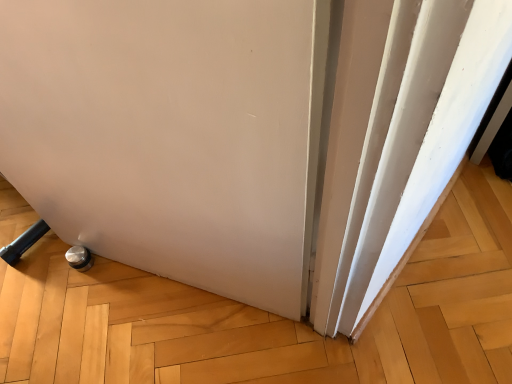
Question: Should I look upward or downward to see white matte door at lower left?

Choices:
 (A) up
 (B) down

Answer: (B)

Question: From a real-world perspective, is white matte curtain at right on white matte door at lower left?

Choices:
 (A) yes
 (B) no

Answer: (B)

Question: Is white matte curtain at right surrounding white matte door at lower left?

Choices:
 (A) yes
 (B) no

Answer: (B)

Question: Is white matte curtain at right in contact with white matte door at lower left?

Choices:
 (A) yes
 (B) no

Answer: (B)

Question: Is white matte curtain at right in front of white matte door at lower left?

Choices:
 (A) no
 (B) yes

Answer: (A)

Question: Is white matte curtain at right completely or partially outside of white matte door at lower left?

Choices:
 (A) yes
 (B) no

Answer: (A)

Question: Is white matte curtain at right positioned with its back to white matte door at lower left?

Choices:
 (A) no
 (B) yes

Answer: (A)

Question: Considering the relative sizes of white matte door at lower left and white matte curtain at right in the image provided, is white matte door at lower left smaller than white matte curtain at right?

Choices:
 (A) yes
 (B) no

Answer: (B)

Question: Is white matte door at lower left closer to the viewer compared to white matte curtain at right?

Choices:
 (A) no
 (B) yes

Answer: (B)

Question: Would you consider white matte door at lower left to be distant from white matte curtain at right?

Choices:
 (A) no
 (B) yes

Answer: (A)

Question: Is white matte curtain at right at the back of white matte door at lower left?

Choices:
 (A) yes
 (B) no

Answer: (B)

Question: Can you confirm if white matte door at lower left is bigger than white matte curtain at right?

Choices:
 (A) yes
 (B) no

Answer: (A)

Question: Is white matte door at lower left shorter than white matte curtain at right?

Choices:
 (A) yes
 (B) no

Answer: (B)

Question: Does point (361, 183) appear closer or farther from the camera than point (52, 41)?

Choices:
 (A) farther
 (B) closer

Answer: (B)